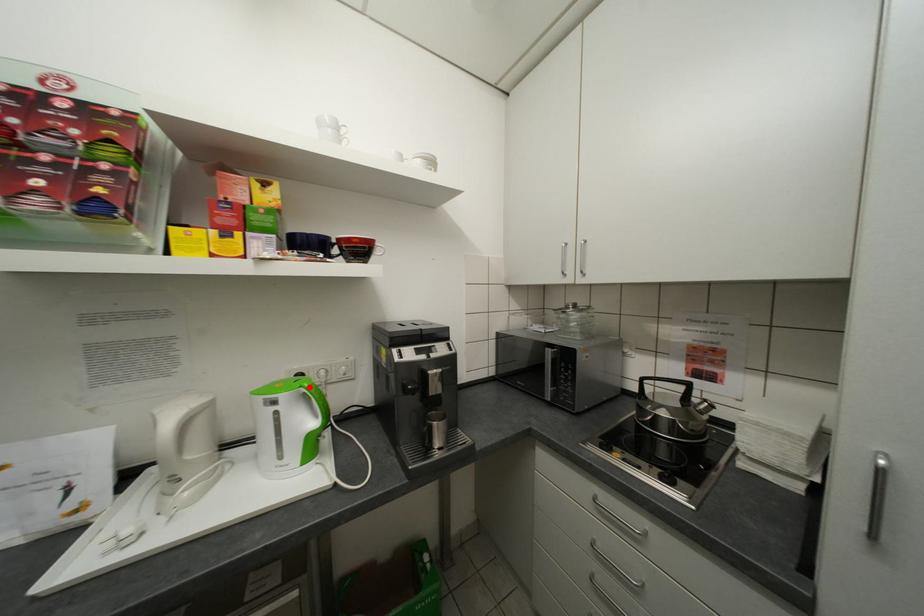
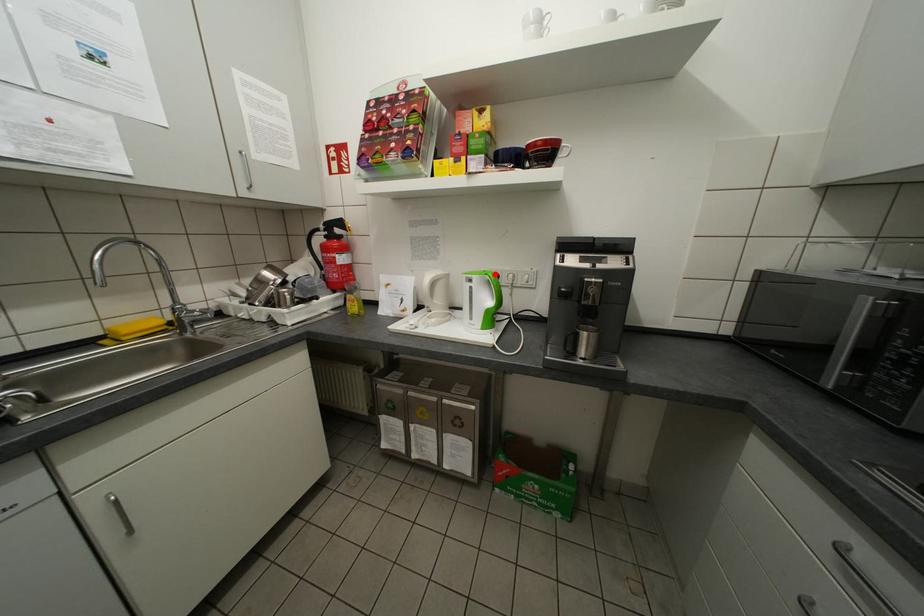
I am providing you with two images of the same scene from different viewpoints. A red point is marked on the first image and another point is marked on the second image. Does the point marked in image1 correspond to the same location as the one in image2?

Yes